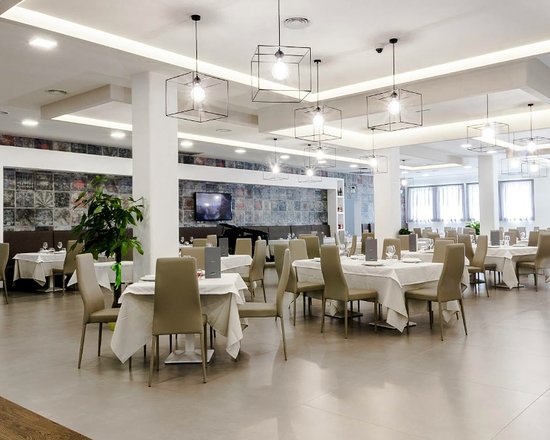
At what (x,y) coordinates should I click in order to perform the action: click on white columns, trim and ceilings. Please return your answer as a coordinate pair (x, y). The height and width of the screenshot is (440, 550). Looking at the image, I should click on (227, 174), (89, 168), (159, 172), (493, 198), (392, 191), (446, 34), (79, 65).